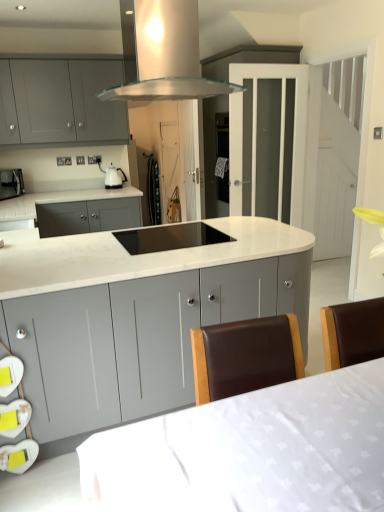
Describe the element at coordinates (11, 183) in the screenshot. This screenshot has width=384, height=512. I see `matte black microwave at left` at that location.

This screenshot has width=384, height=512. What do you see at coordinates (112, 176) in the screenshot?
I see `white glossy kettle at upper left` at bounding box center [112, 176].

The width and height of the screenshot is (384, 512). What do you see at coordinates (168, 55) in the screenshot? I see `transparent glass range hood at upper center` at bounding box center [168, 55].

Image resolution: width=384 pixels, height=512 pixels. I want to click on matte black microwave at left, so click(x=11, y=183).

Which of these two, white fabric table at lower center or white glossy kettle at upper left, stands shorter?

Standing shorter between the two is white glossy kettle at upper left.

From a real-world perspective, which object stands above the other?

white glossy kettle at upper left is physically above.

Is white fabric table at lower center at the left side of white glossy kettle at upper left?

No.

The image size is (384, 512). Identify the location of appliance above the white fabric table at lower center (from the image's perspective). (112, 176).

Is white fabric table at lower center surrounding matte black microwave at left?

Actually, matte black microwave at left is outside white fabric table at lower center.

Which object is wider, white fabric table at lower center or matte black microwave at left?

white fabric table at lower center is wider.

Is matte gray cabinets at upper left, arranged as the first cabinetry when viewed from the top, further to camera compared to white marble countertop at center?

No.

Does matte gray cabinets at upper left, the second cabinetry ordered from the bottom, turn towards white marble countertop at center?

No.

In terms of size, does matte gray cabinets at upper left, arranged as the first cabinetry when viewed from the top, appear bigger or smaller than white marble countertop at center?

Considering their sizes, matte gray cabinets at upper left, arranged as the first cabinetry when viewed from the top, takes up less space than white marble countertop at center.

How different are the orientations of transparent glass range hood at upper center and white fabric table at lower center in degrees?

There is a 0.437-degree angle between the facing directions of transparent glass range hood at upper center and white fabric table at lower center.

Would you say transparent glass range hood at upper center is to the left or to the right of white fabric table at lower center in the picture?

transparent glass range hood at upper center is positioned on white fabric table at lower center's left side.

Does point (189, 64) appear closer or farther from the camera than point (104, 481)?

Clearly, point (189, 64) is more distant from the camera than point (104, 481).

Which of these two, white glossy kettle at upper left or white fabric table at lower center, stands shorter?

Standing shorter between the two is white glossy kettle at upper left.

Can you confirm if white glossy kettle at upper left is wider than white fabric table at lower center?

In fact, white glossy kettle at upper left might be narrower than white fabric table at lower center.

From a real-world perspective, is white glossy kettle at upper left above or below white fabric table at lower center?

From a real-world perspective, white glossy kettle at upper left is physically above white fabric table at lower center.

Can you tell me how much transparent glass range hood at upper center and black glass cooktop at center differ in facing direction?

They differ by 1.63 degrees in their facing directions.

Considering the positions of objects transparent glass range hood at upper center and black glass cooktop at center in the image provided, who is more to the left, transparent glass range hood at upper center or black glass cooktop at center?

Positioned to the left is transparent glass range hood at upper center.

Locate an element on the screen. Image resolution: width=384 pixels, height=512 pixels. sink that appears on the right of transparent glass range hood at upper center is located at coordinates (169, 237).

Is transparent glass range hood at upper center facing away from black glass cooktop at center?

No.

Is point (15, 223) less distant than point (136, 248)?

No, (15, 223) is further to viewer.

Is white marble countertop at center completely or partially outside of black glass cooktop at center?

Yes.

Is white marble countertop at center next to black glass cooktop at center and touching it?

white marble countertop at center and black glass cooktop at center are clearly separated.

The width and height of the screenshot is (384, 512). Find the location of `appliance lying on the left of white fabric table at lower center`. appliance lying on the left of white fabric table at lower center is located at coordinates (112, 176).

I want to click on kitchen appliance above the white fabric table at lower center (from a real-world perspective), so click(11, 183).

Considering their positions, is white fabric table at lower center positioned further to matte black microwave at left than matte gray cabinets at center, the 1th cabinetry when ordered from front to back?

white fabric table at lower center is further to matte black microwave at left.

Which object lies nearer to the anchor point matte gray cabinets at upper left, arranged as the first cabinetry when viewed from the top, matte black microwave at left or white fabric table at lower center?

Among the two, matte black microwave at left is located nearer to matte gray cabinets at upper left, arranged as the first cabinetry when viewed from the top.

From the image, which object appears to be nearer to matte gray cabinets at center, arranged as the second cabinetry when viewed from the top, black glass cooktop at center or white marble countertop at center?

Among the two, black glass cooktop at center is located nearer to matte gray cabinets at center, arranged as the second cabinetry when viewed from the top.

Looking at the image, which one is located closer to matte gray cabinets at upper left, which appears as the 2th cabinetry when viewed from the front, matte gray cabinets at center, the 1th cabinetry when ordered from front to back, or white fabric table at lower center?

Among the two, matte gray cabinets at center, the 1th cabinetry when ordered from front to back, is located nearer to matte gray cabinets at upper left, which appears as the 2th cabinetry when viewed from the front.

Looking at this image, based on their spatial positions, is matte gray cabinets at center, which is counted as the second cabinetry, starting from the back, or white fabric table at lower center further from white glossy kettle at upper left?

Based on the image, white fabric table at lower center appears to be further to white glossy kettle at upper left.

From the image, which object appears to be nearer to matte black microwave at left, transparent glass range hood at upper center or white glossy kettle at upper left?

white glossy kettle at upper left.

Looking at the image, which one is located further to black glass cooktop at center, matte gray cabinets at center, the first cabinetry from the bottom, or white marble countertop at center?

white marble countertop at center.

Looking at the image, which one is located closer to white marble countertop at center, white glossy kettle at upper left or transparent glass range hood at upper center?

white glossy kettle at upper left is closer to white marble countertop at center.

Where is `cabinetry between black glass cooktop at center and white glossy kettle at upper left from front to back`? Image resolution: width=384 pixels, height=512 pixels. cabinetry between black glass cooktop at center and white glossy kettle at upper left from front to back is located at coordinates (60, 102).

Where is `cabinetry between matte gray cabinets at center, the 1th cabinetry when ordered from front to back, and white glossy kettle at upper left from front to back`? The height and width of the screenshot is (512, 384). cabinetry between matte gray cabinets at center, the 1th cabinetry when ordered from front to back, and white glossy kettle at upper left from front to back is located at coordinates (60, 102).

I want to click on countertop between black glass cooktop at center and matte black microwave at left from front to back, so click(x=52, y=202).

Identify the location of countertop located between transparent glass range hood at upper center and white glossy kettle at upper left in the depth direction. (52, 202).